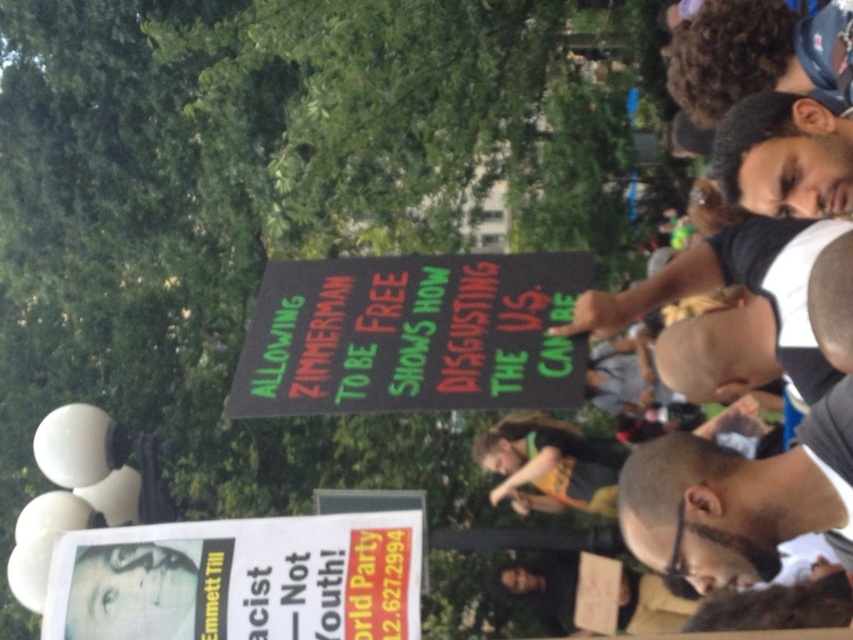
Question: Is dark brown hair at center closer to the viewer compared to dark skin face at upper right?

Choices:
 (A) yes
 (B) no

Answer: (A)

Question: Can you confirm if dark brown hair at center is positioned above dark skin face at upper right?

Choices:
 (A) no
 (B) yes

Answer: (A)

Question: Which point is closer to the camera taking this photo?

Choices:
 (A) (821, 188)
 (B) (822, 440)

Answer: (B)

Question: Is dark brown hair at center further to camera compared to dark skin face at upper right?

Choices:
 (A) yes
 (B) no

Answer: (B)

Question: Which point is closer to the camera?

Choices:
 (A) (750, 125)
 (B) (839, 396)

Answer: (B)